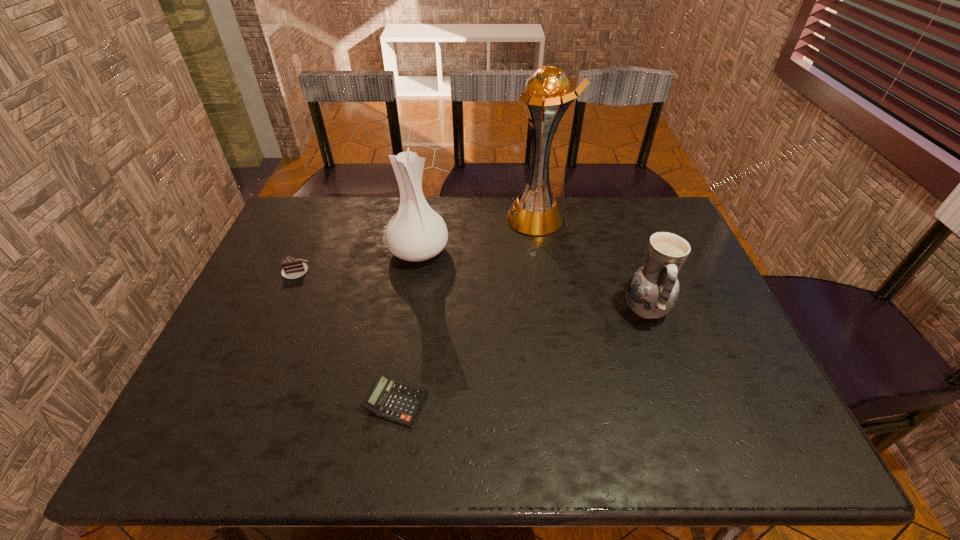
Find the location of a particular element. This screenshot has height=540, width=960. free space located on the front-facing side of the trophy is located at coordinates (395, 218).

Locate an element on the screen. The image size is (960, 540). vacant space located on the front-facing side of the trophy is located at coordinates (392, 218).

You are a GUI agent. You are given a task and a screenshot of the screen. Output one action in this format:
    pyautogui.click(x=<x>, y=<y>)
    Task: Click on the vacant region located 0.370m on the front of the vase
    Image resolution: width=960 pixels, height=540 pixels.
    Given the screenshot: What is the action you would take?
    pyautogui.click(x=398, y=380)

Where is `free location located 0.320m on either side of the rightmost object`? The image size is (960, 540). free location located 0.320m on either side of the rightmost object is located at coordinates (504, 310).

At what (x,y) coordinates should I click in order to perform the action: click on blank area located on either side of the rightmost object. Please return your answer as a coordinate pair (x, y). Image resolution: width=960 pixels, height=540 pixels. Looking at the image, I should click on 496,310.

Locate an element on the screen. The image size is (960, 540). free region located on either side of the rightmost object is located at coordinates (482, 310).

Locate an element on the screen. free space located on the back of the second shortest object is located at coordinates (311, 236).

Where is `vacant space positioned 0.180m on the back of the calculator`? vacant space positioned 0.180m on the back of the calculator is located at coordinates (408, 319).

This screenshot has height=540, width=960. Identify the location of trophy at the far edge. (535, 212).

The width and height of the screenshot is (960, 540). Identify the location of vase present at the far edge. (416, 232).